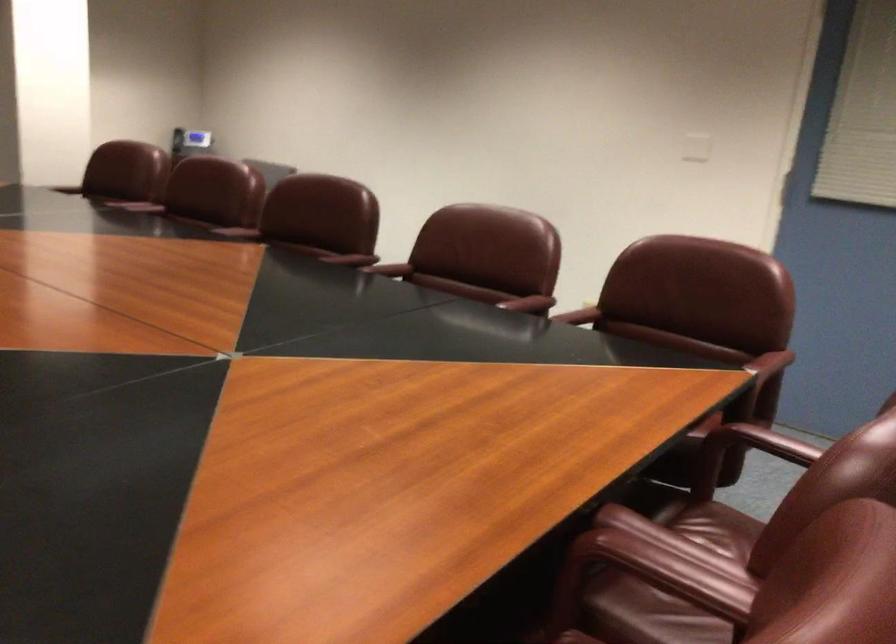
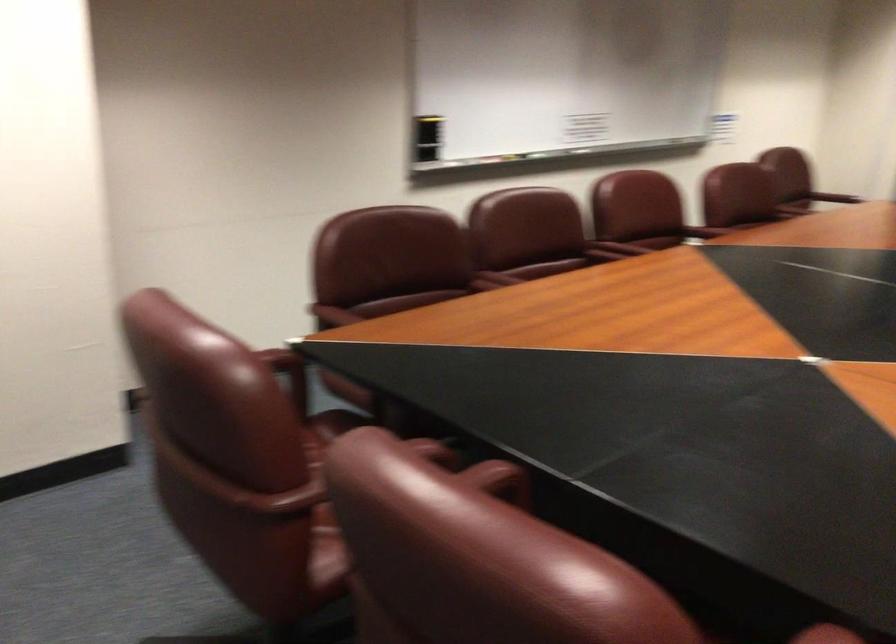
Locate, in the second image, the point that corresponds to [574,315] in the first image.

(433, 450)